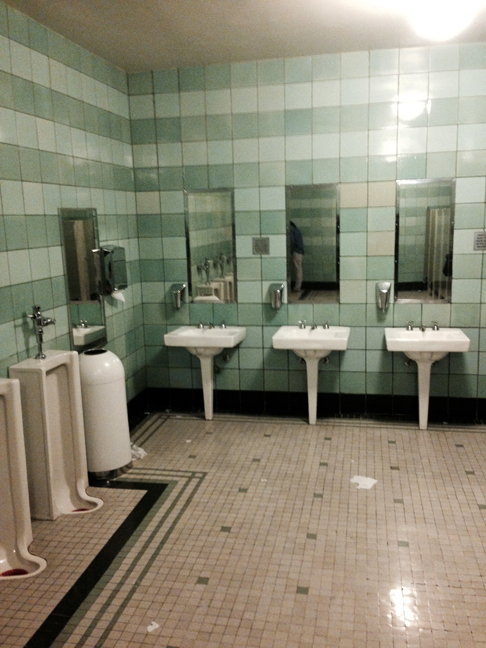
Identify the location of napkin. (118, 295).